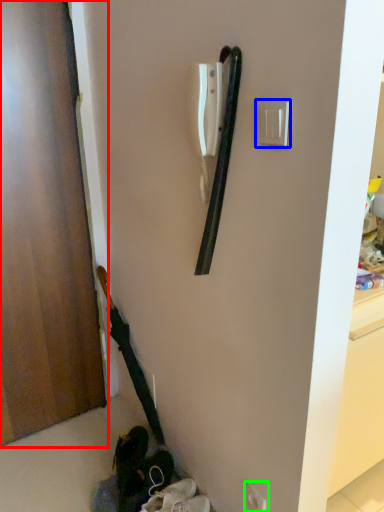
Question: Based on their relative distances, which object is farther from door (highlighted by a red box)? Choose from light switch (highlighted by a blue box) and electric outlet (highlighted by a green box).

Choices:
 (A) light switch
 (B) electric outlet

Answer: (B)